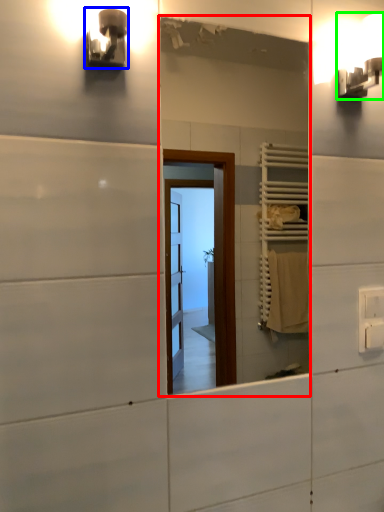
Question: Estimate the real-world distances between objects in this image. Which object is closer to mirror (highlighted by a red box), light fixture (highlighted by a blue box) or light fixture (highlighted by a green box)?

Choices:
 (A) light fixture
 (B) light fixture

Answer: (B)